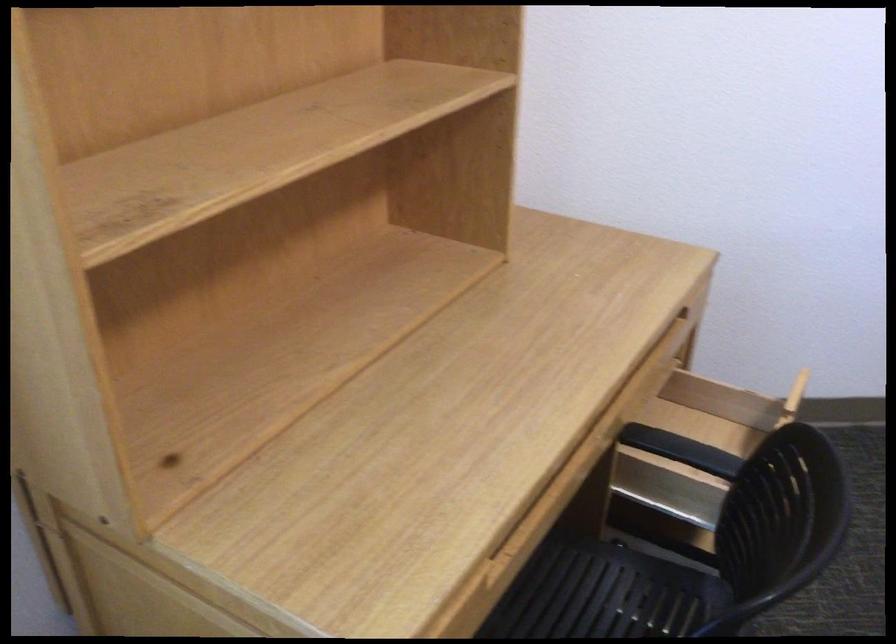
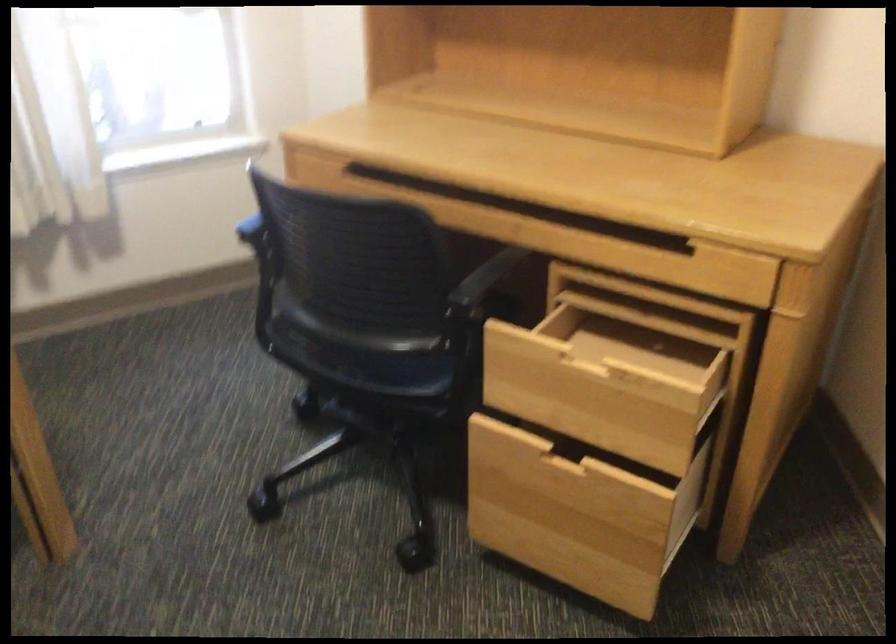
Find the pixel in the second image that matches [583,355] in the first image.

(668, 240)